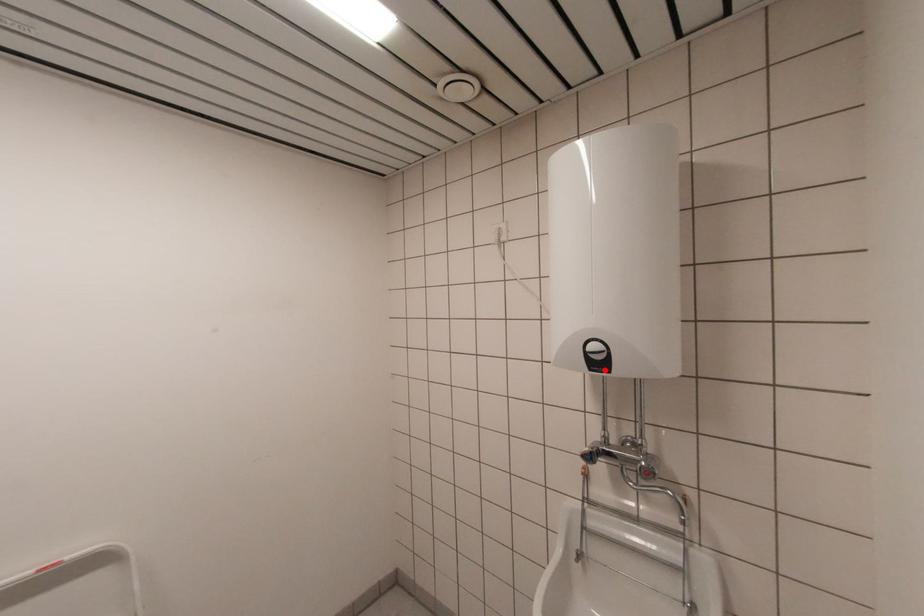
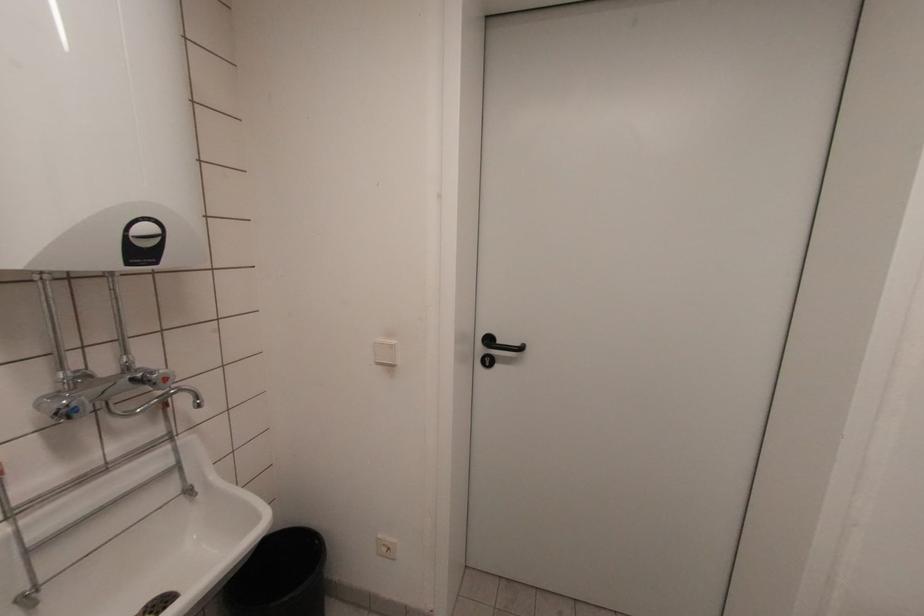
In the second image, find the point that corresponds to the highlighted location in the first image.

(151, 261)